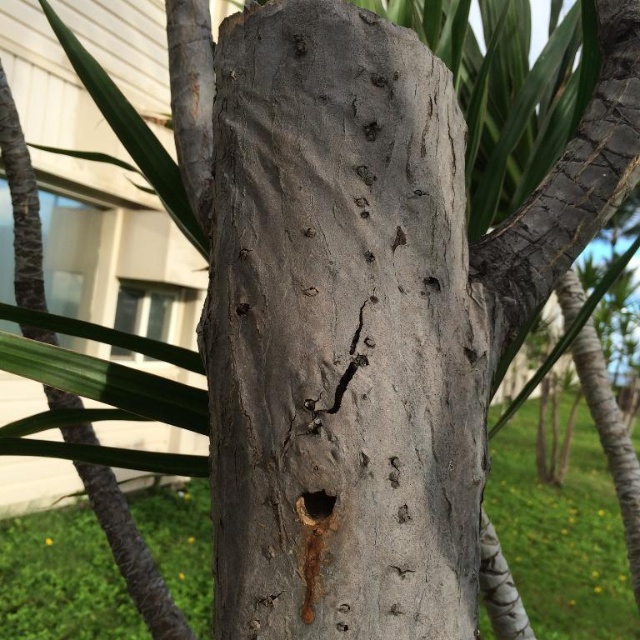
You are a biologist studying tree structures. You observe the gray rough bark tree trunk at center and the smooth dark brown hole at center. Which object is wider in diameter?

The gray rough bark tree trunk at center is wider in diameter than the smooth dark brown hole at center according to the description.

You are standing 1.5 meters away from the tree trunk. If you move forward 0.4 meters towards the tree trunk, will you be closer than the point at point (412,61)?

The distance of point (412,61) from camera is 1.10 meters. After moving forward 0.4 meters from your original position 1.5 meters away, you will be 1.1 meters away from the tree trunk, which is exactly the same distance as the point (412,61). Therefore, you will be at the same distance as the point.

From the picture: You are a biologist observing a tree trunk and its features. You notice the gray rough bark tree trunk at center and the smooth dark brown hole at center. Based on their positions, which object is located to the left?

The smooth dark brown hole at center is located to the left of the gray rough bark tree trunk at center.